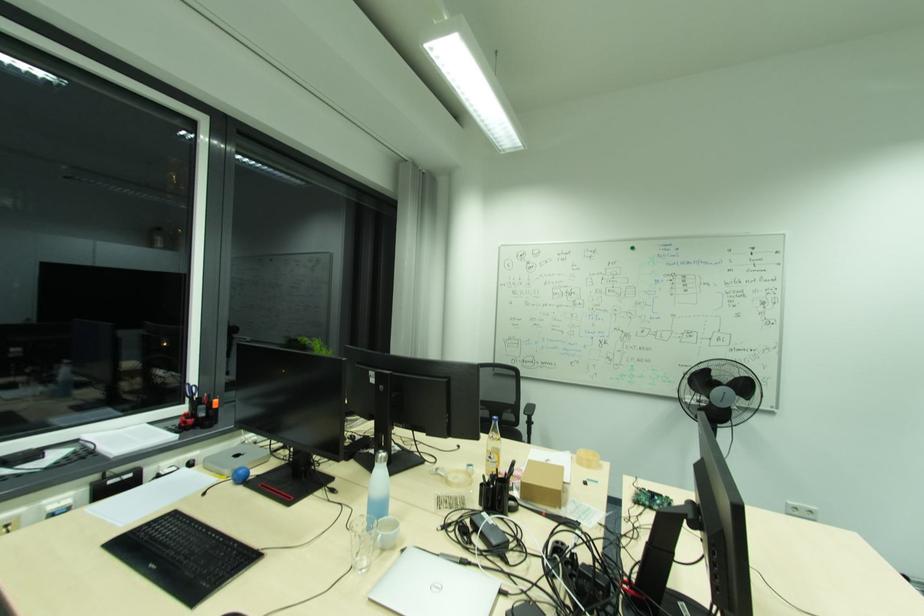
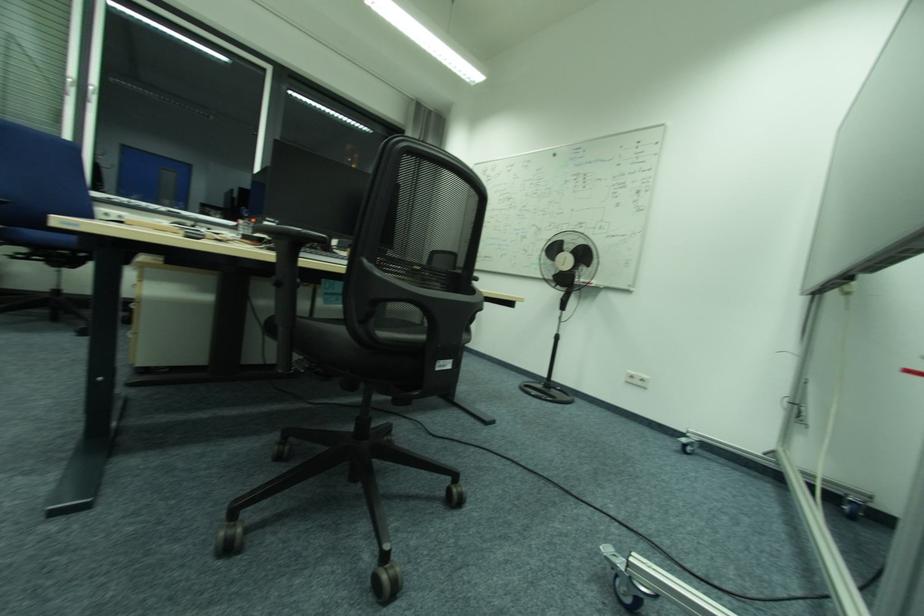
Question: I am providing you with two images of the same scene from different viewpoints. Please identify which objects are invisible in image2.

Choices:
 (A) small cardboard box
 (B) black cordless phone
 (C) black chair sitting surface
 (D) white window handle

Answer: (A)